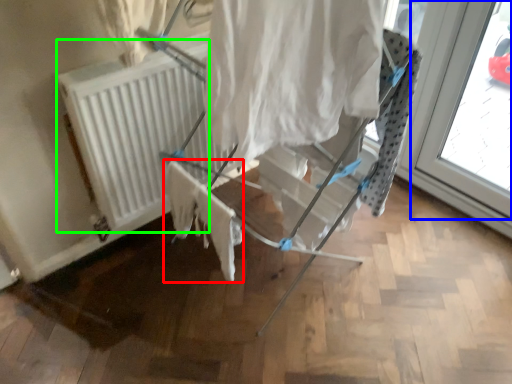
Question: Which is nearer to the fabric (highlighted by a red box)? window (highlighted by a blue box) or radiator (highlighted by a green box).

Choices:
 (A) window
 (B) radiator

Answer: (B)